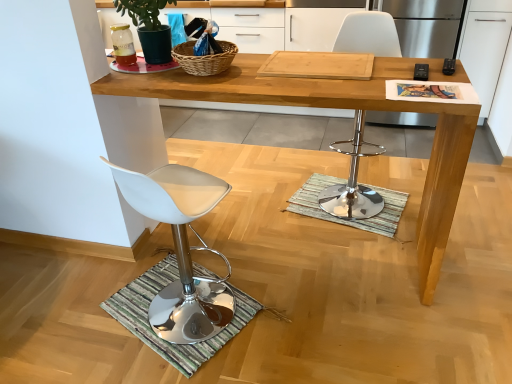
This screenshot has height=384, width=512. Describe the element at coordinates (204, 59) in the screenshot. I see `woven brown picnic basket at upper center` at that location.

Identify the location of chrome metallic bar stool at center, which is the 1th chair from right to left. (353, 182).

In order to face green matte plant at upper left, should I rotate leftwards or rightwards?

Turn left by 13.035 degrees to look at green matte plant at upper left.

Looking at this image, what is the approximate height of green matte plant at upper left?

It is 11.08 inches.

Describe the element at coordinates (155, 333) in the screenshot. Image resolution: width=512 pixels, height=384 pixels. I see `green striped mat at lower left, which is the 2th doormat from top to bottom` at that location.

Measure the distance between point (310, 184) and camera.

Point (310, 184) is 8.88 feet away from camera.

Locate an element on the screen. This screenshot has height=384, width=512. striped fabric doormat at center, the second doormat in the bottom-to-top sequence is located at coordinates (348, 219).

At what (x,y) coordinates should I click in order to perform the action: click on woven brown picnic basket at upper center. Please return your answer as a coordinate pair (x, y). This screenshot has height=384, width=512. Looking at the image, I should click on (204, 59).

Based on the photo, how much distance is there between chrome metallic bar stool at center, which is the 1th chair from right to left, and wooden desk at center?

The distance of chrome metallic bar stool at center, which is the 1th chair from right to left, from wooden desk at center is 33.64 inches.

From a real-world perspective, which is physically above, chrome metallic bar stool at center, which is the 1th chair from right to left, or wooden desk at center?

chrome metallic bar stool at center, which is the 1th chair from right to left.

Is chrome metallic bar stool at center, which is the 1th chair from right to left, located outside wooden desk at center?

Indeed, chrome metallic bar stool at center, which is the 1th chair from right to left, is completely outside wooden desk at center.

Which is farther, (364, 205) or (443, 186)?

The point (364, 205) is farther from the camera.

Is black plastic remote control at upper right, marked as the first remote control in a left-to-right arrangement, aimed at black plastic remote control at upper right, marked as the second remote control in a left-to-right arrangement?

Yes, black plastic remote control at upper right, marked as the first remote control in a left-to-right arrangement, is aimed at black plastic remote control at upper right, marked as the second remote control in a left-to-right arrangement.

Which is behind, point (424, 65) or point (447, 63)?

Point (424, 65)

Considering the relative sizes of black plastic remote control at upper right, which is the second remote control from right to left, and black plastic remote control at upper right, the 1th remote control when ordered from right to left, in the image provided, is black plastic remote control at upper right, which is the second remote control from right to left, shorter than black plastic remote control at upper right, the 1th remote control when ordered from right to left,?

Yes.

Does black plastic remote control at upper right, marked as the first remote control in a left-to-right arrangement, have a lesser width compared to black plastic remote control at upper right, marked as the second remote control in a left-to-right arrangement?

In fact, black plastic remote control at upper right, marked as the first remote control in a left-to-right arrangement, might be wider than black plastic remote control at upper right, marked as the second remote control in a left-to-right arrangement.

From a real-world perspective, which is physically below, striped fabric doormat at center, the second doormat in the bottom-to-top sequence, or green striped mat at lower left, which is the 2th doormat from top to bottom?

In real-world perspective, striped fabric doormat at center, the second doormat in the bottom-to-top sequence, is lower.

Can you tell me how much striped fabric doormat at center, the second doormat in the bottom-to-top sequence, and green striped mat at lower left, marked as the first doormat in a front-to-back arrangement, differ in facing direction?

169 degrees.

Find the location of a particular element. doormat that is on the left side of striped fabric doormat at center, placed as the first doormat when sorted from right to left is located at coordinates (155, 333).

Is point (320, 186) closer to viewer compared to point (119, 318)?

That is False.

How different are the orientations of striped fabric doormat at center, placed as the second doormat when sorted from left to right, and wooden desk at center in degrees?

There is a 167-degree angle between the facing directions of striped fabric doormat at center, placed as the second doormat when sorted from left to right, and wooden desk at center.

How much distance is there between striped fabric doormat at center, positioned as the second doormat in front-to-back order, and wooden desk at center?

The distance of striped fabric doormat at center, positioned as the second doormat in front-to-back order, from wooden desk at center is 68.76 centimeters.

Consider the image. Who is taller, striped fabric doormat at center, the second doormat in the bottom-to-top sequence, or wooden desk at center?

Standing taller between the two is wooden desk at center.

Is striped fabric doormat at center, placed as the first doormat when sorted from right to left, facing away from wooden desk at center?

That's not correct — striped fabric doormat at center, placed as the first doormat when sorted from right to left, is not looking away from wooden desk at center.

From the picture: From the image's perspective, is white plastic chair at lower left, which is the second chair in right-to-left order, above or below striped fabric doormat at center, the 1th doormat positioned from the top?

white plastic chair at lower left, which is the second chair in right-to-left order, is below striped fabric doormat at center, the 1th doormat positioned from the top.

Is white plastic chair at lower left, which is the second chair in right-to-left order, looking in the opposite direction of striped fabric doormat at center, the 1th doormat in the back-to-front sequence?

No, striped fabric doormat at center, the 1th doormat in the back-to-front sequence, is not at the back of white plastic chair at lower left, which is the second chair in right-to-left order.

Does white plastic chair at lower left, which is the first chair in left-to-right order, have a greater height compared to striped fabric doormat at center, the 1th doormat positioned from the top?

Yes.

Which object is wider, white plastic chair at lower left, which is the first chair in left-to-right order, or striped fabric doormat at center, the 1th doormat in the back-to-front sequence?

With larger width is striped fabric doormat at center, the 1th doormat in the back-to-front sequence.

From the picture: Is green matte plant at upper left spatially inside black plastic remote control at upper right, which is the second remote control from right to left, or outside of it?

The correct answer is: outside.

In the image, there is a black plastic remote control at upper right, marked as the first remote control in a left-to-right arrangement. Identify the location of houseplant above it (from the image's perspective). Image resolution: width=512 pixels, height=384 pixels. (149, 27).

Consider the image. From the image's perspective, is green matte plant at upper left located beneath black plastic remote control at upper right, which is the second remote control from right to left?

Actually, green matte plant at upper left appears above black plastic remote control at upper right, which is the second remote control from right to left, in the image.

Which of these two, green matte plant at upper left or black plastic remote control at upper right, marked as the first remote control in a left-to-right arrangement, is wider?

Wider between the two is green matte plant at upper left.

From the image's perspective, which is above, woven brown picnic basket at upper center or wooden desk at center?

woven brown picnic basket at upper center, from the image's perspective.

Is woven brown picnic basket at upper center facing away from wooden desk at center?

That's not correct — woven brown picnic basket at upper center is not looking away from wooden desk at center.

Where is `picnic basket above the wooden desk at center (from the image's perspective)`? picnic basket above the wooden desk at center (from the image's perspective) is located at coordinates (204, 59).

At what (x,y) coordinates should I click in order to perform the action: click on desk located on the left of chrome metallic bar stool at center, which is the 1th chair from right to left. Please return your answer as a coordinate pair (x, y). This screenshot has width=512, height=384. Looking at the image, I should click on (348, 108).

This screenshot has width=512, height=384. What are the coordinates of `remote control below the black plastic remote control at upper right, the 1th remote control when ordered from right to left (from the image's perspective)` in the screenshot? It's located at (421, 72).

Which object lies nearer to the anchor point green matte plant at upper left, black plastic remote control at upper right, the 1th remote control when ordered from right to left, or chrome metallic bar stool at center, which is the 1th chair from right to left?

chrome metallic bar stool at center, which is the 1th chair from right to left, is closer to green matte plant at upper left.

When comparing their distances from black plastic remote control at upper right, the 1th remote control when ordered from right to left, does green matte plant at upper left or green striped mat at lower left, the first doormat positioned from the bottom, seem closer?

A: green matte plant at upper left.

Considering their positions, is black plastic remote control at upper right, which is the second remote control from right to left, positioned further to green matte plant at upper left than striped fabric doormat at center, the 1th doormat in the back-to-front sequence?

Based on the image, black plastic remote control at upper right, which is the second remote control from right to left, appears to be further to green matte plant at upper left.

Considering their positions, is wooden desk at center positioned further to green matte plant at upper left than black plastic remote control at upper right, which is the second remote control from right to left?

black plastic remote control at upper right, which is the second remote control from right to left.

Estimate the real-world distances between objects in this image. Which object is further from white plastic chair at lower left, which is the second chair in right-to-left order, black plastic remote control at upper right, the 1th remote control when ordered from right to left, or green matte plant at upper left?

black plastic remote control at upper right, the 1th remote control when ordered from right to left, is further to white plastic chair at lower left, which is the second chair in right-to-left order.

When comparing their distances from white plastic chair at lower left, which is the first chair in left-to-right order, does wooden desk at center or green striped mat at lower left, marked as the first doormat in a front-to-back arrangement, seem further?

The object further to white plastic chair at lower left, which is the first chair in left-to-right order, is wooden desk at center.

From the picture: Based on their spatial positions, is woven brown picnic basket at upper center or green striped mat at lower left, marked as the first doormat in a front-to-back arrangement, closer to green matte plant at upper left?

woven brown picnic basket at upper center is closer to green matte plant at upper left.

When comparing their distances from chrome metallic bar stool at center, the 2th chair positioned from the left, does black plastic remote control at upper right, marked as the second remote control in a left-to-right arrangement, or woven brown picnic basket at upper center seem further?

woven brown picnic basket at upper center is positioned further to the anchor chrome metallic bar stool at center, the 2th chair positioned from the left.

In order to click on doormat located between green striped mat at lower left, which is the 2th doormat from top to bottom, and chrome metallic bar stool at center, the 2th chair positioned from the left, in the left-right direction in this screenshot , I will do `click(348, 219)`.

At what (x,y) coordinates should I click in order to perform the action: click on doormat located between green striped mat at lower left, which is the 2th doormat from top to bottom, and black plastic remote control at upper right, which is the second remote control from right to left, in the left-right direction. Please return your answer as a coordinate pair (x, y). Looking at the image, I should click on (348, 219).

At what (x,y) coordinates should I click in order to perform the action: click on desk between chrome metallic bar stool at center, the 2th chair positioned from the left, and green striped mat at lower left, which is the 2th doormat from top to bottom, from top to bottom. Please return your answer as a coordinate pair (x, y). Looking at the image, I should click on (348, 108).

You are a GUI agent. You are given a task and a screenshot of the screen. Output one action in this format:
    pyautogui.click(x=<x>, y=<y>)
    Task: Click on the desk between green matte plant at upper left and white plastic chair at lower left, which is the second chair in right-to-left order, in the vertical direction
    Image resolution: width=512 pixels, height=384 pixels.
    Given the screenshot: What is the action you would take?
    pyautogui.click(x=348, y=108)